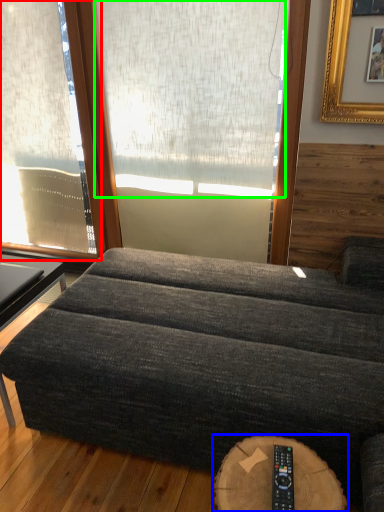
Question: Estimate the real-world distances between objects in this image. Which object is farther from window (highlighted by a red box), round table (highlighted by a blue box) or window screen (highlighted by a green box)?

Choices:
 (A) round table
 (B) window screen

Answer: (A)